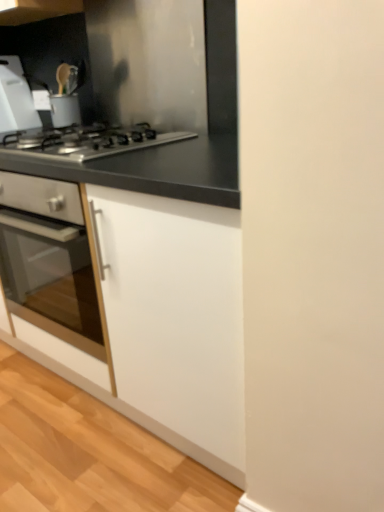
Question: From the image's perspective, relative to white plastic cutting board at upper left, is stainless steel gas stove at center above or below?

Choices:
 (A) above
 (B) below

Answer: (B)

Question: Considering the positions of stainless steel gas stove at center and white plastic cutting board at upper left in the image, is stainless steel gas stove at center taller or shorter than white plastic cutting board at upper left?

Choices:
 (A) short
 (B) tall

Answer: (A)

Question: Estimate the real-world distances between objects in this image. Which object is farther from the stainless steel gas stove at center?

Choices:
 (A) white plastic cutting board at upper left
 (B) black matte countertop at upper left
 (C) white matte cabinet at center

Answer: (A)

Question: Which object is positioned closest to the black matte countertop at upper left?

Choices:
 (A) white plastic cutting board at upper left
 (B) white matte cabinet at center
 (C) stainless steel gas stove at center

Answer: (B)